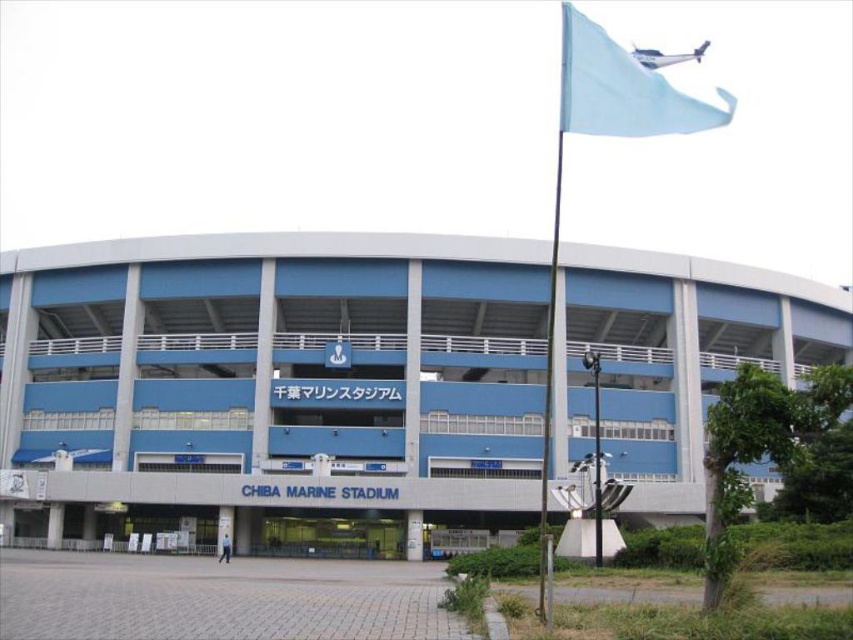
Question: Among these objects, which one is nearest to the camera?

Choices:
 (A) light blue fabric flag at upper right
 (B) blue metallic flag pole at center-right

Answer: (A)

Question: Is blue concrete stadium at center bigger than light blue fabric flag at upper right?

Choices:
 (A) yes
 (B) no

Answer: (B)

Question: Considering the real-world distances, which object is farthest from the blue concrete stadium at center?

Choices:
 (A) light blue fabric flag at upper right
 (B) blue metallic flag pole at center-right

Answer: (A)

Question: Which is farther from the blue metallic flag pole at center-right?

Choices:
 (A) light blue fabric flag at upper right
 (B) blue concrete stadium at center

Answer: (B)

Question: Can you confirm if blue concrete stadium at center is smaller than blue metallic flag pole at center-right?

Choices:
 (A) no
 (B) yes

Answer: (B)

Question: Is the position of blue concrete stadium at center more distant than that of blue metallic flag pole at center-right?

Choices:
 (A) yes
 (B) no

Answer: (A)